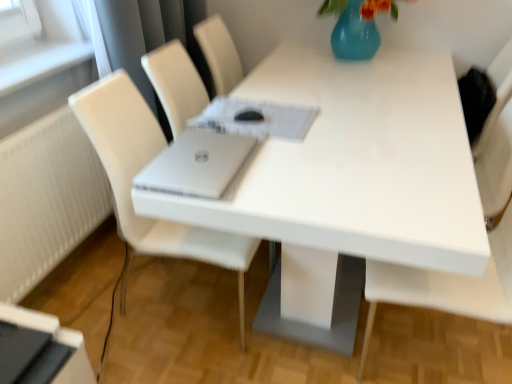
The width and height of the screenshot is (512, 384). What do you see at coordinates (40, 349) in the screenshot?
I see `black glossy desktop at lower left` at bounding box center [40, 349].

Image resolution: width=512 pixels, height=384 pixels. What do you see at coordinates (139, 171) in the screenshot? I see `white leather chair at center, the first chair in the left-to-right sequence` at bounding box center [139, 171].

The height and width of the screenshot is (384, 512). Describe the element at coordinates (485, 224) in the screenshot. I see `white matte chair at right, which appears as the 1th chair when viewed from the right` at that location.

The height and width of the screenshot is (384, 512). I want to click on white matte chair at right, which ranks as the second chair in left-to-right order, so pyautogui.click(x=485, y=224).

What are the coordinates of `white glossy table at center` in the screenshot? It's located at (352, 174).

The height and width of the screenshot is (384, 512). I want to click on black glossy desktop at lower left, so click(40, 349).

Is white glossy table at center at the back of black glossy desktop at lower left?

No, black glossy desktop at lower left is not facing the opposite direction of white glossy table at center.

From the image's perspective, which one is positioned lower, black glossy desktop at lower left or white glossy table at center?

black glossy desktop at lower left is shown below in the image.

Is black glossy desktop at lower left spatially inside white glossy table at center, or outside of it?

black glossy desktop at lower left is spatially situated outside white glossy table at center.

Does black glossy desktop at lower left have a greater width compared to white leather chair at center, the first chair in the left-to-right sequence?

No.

Which is farther from the camera, (33, 314) or (118, 199)?

The point (118, 199) is farther.

Is white leather chair at center, the second chair positioned from the right, a part of black glossy desktop at lower left?

No, white leather chair at center, the second chair positioned from the right, is not inside black glossy desktop at lower left.

Does point (217, 196) appear closer or farther from the camera than point (47, 381)?

Point (217, 196) is closer to the camera than point (47, 381).

Is silver metallic laptop at center not close to black glossy desktop at lower left?

No, silver metallic laptop at center is in close proximity to black glossy desktop at lower left.

From the picture: From a real-world perspective, which is physically below, silver metallic laptop at center or black glossy desktop at lower left?

In real-world perspective, black glossy desktop at lower left is lower.

Which object is positioned more to the left, white matte chair at right, which appears as the 1th chair when viewed from the right, or black glossy desktop at lower left?

black glossy desktop at lower left is more to the left.

Which object is closer to the camera taking this photo, white matte chair at right, which appears as the 1th chair when viewed from the right, or black glossy desktop at lower left?

white matte chair at right, which appears as the 1th chair when viewed from the right, is in front.

In the scene shown: From a real-world perspective, between white matte chair at right, which ranks as the second chair in left-to-right order, and black glossy desktop at lower left, who is vertically lower?

black glossy desktop at lower left is physically lower.

Between white matte chair at right, which appears as the 1th chair when viewed from the right, and black glossy desktop at lower left, which one has smaller size?

black glossy desktop at lower left is smaller.

Based on the photo, between white glossy table at center and white leather chair at center, the first chair in the left-to-right sequence, which one has smaller width?

With smaller width is white leather chair at center, the first chair in the left-to-right sequence.

What's the angular difference between white glossy table at center and white leather chair at center, the first chair in the left-to-right sequence,'s facing directions?

The angular difference between white glossy table at center and white leather chair at center, the first chair in the left-to-right sequence, is 86.8 degrees.

Are white glossy table at center and white leather chair at center, the second chair positioned from the right, located far from each other?

No, white glossy table at center is not far from white leather chair at center, the second chair positioned from the right.

Which object is positioned more to the left, white glossy table at center or white matte chair at right, which appears as the 1th chair when viewed from the right?

white glossy table at center is more to the left.

Which is correct: white glossy table at center is inside white matte chair at right, which ranks as the second chair in left-to-right order, or outside of it?

white glossy table at center is outside white matte chair at right, which ranks as the second chair in left-to-right order.

From the image's perspective, is white glossy table at center above or below white matte chair at right, which ranks as the second chair in left-to-right order?

white glossy table at center is situated higher than white matte chair at right, which ranks as the second chair in left-to-right order, in the image.

Who is smaller, white glossy table at center or white matte chair at right, which ranks as the second chair in left-to-right order?

white matte chair at right, which ranks as the second chair in left-to-right order.

Is white matte chair at right, which ranks as the second chair in left-to-right order, taller or shorter than white glossy table at center?

Clearly, white matte chair at right, which ranks as the second chair in left-to-right order, is taller compared to white glossy table at center.

Considering the points (497, 107) and (389, 221), which point is behind, point (497, 107) or point (389, 221)?

The point (497, 107) is farther.

Which is more to the left, white matte chair at right, which appears as the 1th chair when viewed from the right, or white glossy table at center?

white glossy table at center.

Based on their sizes in the image, would you say white matte chair at right, which ranks as the second chair in left-to-right order, is bigger or smaller than white glossy table at center?

Clearly, white matte chair at right, which ranks as the second chair in left-to-right order, is smaller in size than white glossy table at center.

Image resolution: width=512 pixels, height=384 pixels. I want to click on table lying above the black glossy desktop at lower left (from the image's perspective), so click(352, 174).

You are a GUI agent. You are given a task and a screenshot of the screen. Output one action in this format:
    pyautogui.click(x=<x>, y=<y>)
    Task: Click on the chair that is the 1st one when counting rightward from the black glossy desktop at lower left
    This screenshot has height=384, width=512.
    Given the screenshot: What is the action you would take?
    139,171

Considering their positions, is white leather chair at center, the first chair in the left-to-right sequence, positioned further to white glossy table at center than white matte chair at right, which appears as the 1th chair when viewed from the right?

Based on the image, white leather chair at center, the first chair in the left-to-right sequence, appears to be further to white glossy table at center.

Considering their positions, is silver metallic laptop at center positioned closer to white glossy table at center than black glossy desktop at lower left?

silver metallic laptop at center lies closer to white glossy table at center than the other object.

Estimate the real-world distances between objects in this image. Which object is further from white leather chair at center, the second chair positioned from the right, white matte chair at right, which ranks as the second chair in left-to-right order, or white glossy table at center?

Among the two, white matte chair at right, which ranks as the second chair in left-to-right order, is located further to white leather chair at center, the second chair positioned from the right.

In the scene shown: From the image, which object appears to be farther from white leather chair at center, the second chair positioned from the right, black glossy desktop at lower left or white matte chair at right, which ranks as the second chair in left-to-right order?

white matte chair at right, which ranks as the second chair in left-to-right order, lies further to white leather chair at center, the second chair positioned from the right, than the other object.

Looking at the image, which one is located further to white glossy table at center, white matte chair at right, which ranks as the second chair in left-to-right order, or silver metallic laptop at center?

white matte chair at right, which ranks as the second chair in left-to-right order, is further to white glossy table at center.

Estimate the real-world distances between objects in this image. Which object is closer to white leather chair at center, the second chair positioned from the right, silver metallic laptop at center or white matte chair at right, which ranks as the second chair in left-to-right order?

The object closer to white leather chair at center, the second chair positioned from the right, is silver metallic laptop at center.

Estimate the real-world distances between objects in this image. Which object is closer to white leather chair at center, the first chair in the left-to-right sequence, black glossy desktop at lower left or white glossy table at center?

black glossy desktop at lower left is positioned closer to the anchor white leather chair at center, the first chair in the left-to-right sequence.

Based on their spatial positions, is white leather chair at center, the first chair in the left-to-right sequence, or white glossy table at center further from black glossy desktop at lower left?

Based on the image, white glossy table at center appears to be further to black glossy desktop at lower left.

The width and height of the screenshot is (512, 384). I want to click on laptop between white leather chair at center, the second chair positioned from the right, and white matte chair at right, which appears as the 1th chair when viewed from the right, so click(x=196, y=164).

I want to click on table between silver metallic laptop at center and white matte chair at right, which ranks as the second chair in left-to-right order, in the horizontal direction, so click(352, 174).

Where is `chair between black glossy desktop at lower left and white matte chair at right, which ranks as the second chair in left-to-right order`? chair between black glossy desktop at lower left and white matte chair at right, which ranks as the second chair in left-to-right order is located at coordinates (139, 171).

Locate an element on the screen. table situated between black glossy desktop at lower left and white matte chair at right, which appears as the 1th chair when viewed from the right, from left to right is located at coordinates 352,174.